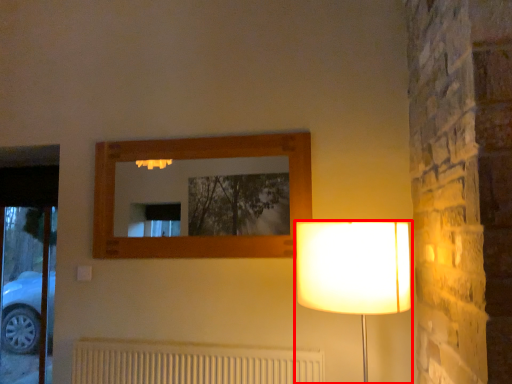
Question: From the image's perspective, what is the correct spatial positioning of lamp (annotated by the red box) in reference to radiator?

Choices:
 (A) below
 (B) above

Answer: (B)